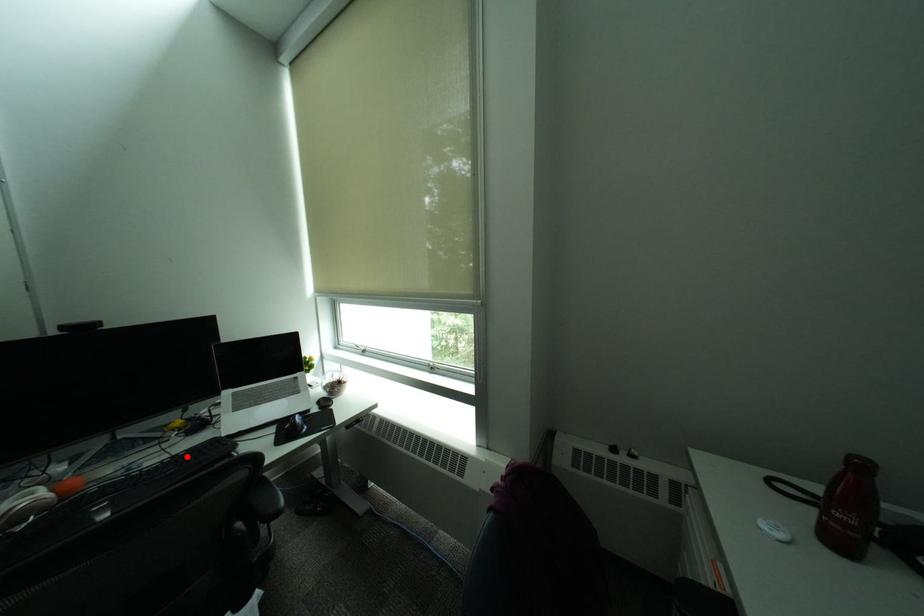
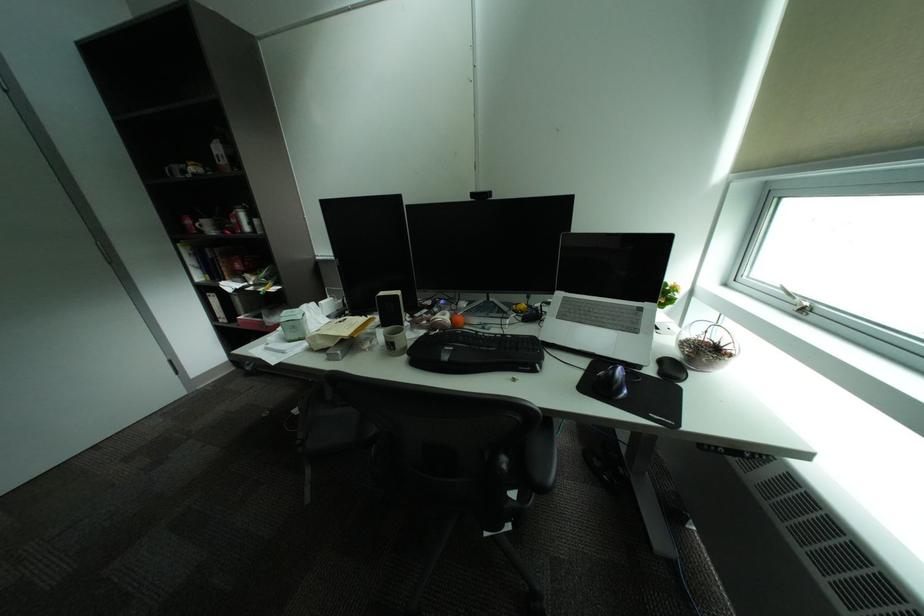
Locate, in the second image, the point that corresponds to the highlighted location in the first image.

(516, 336)